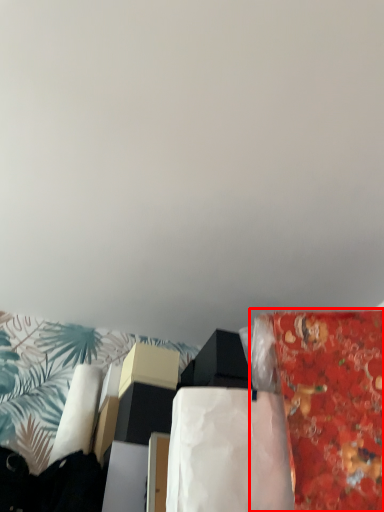
Question: From the image's perspective, what is the correct spatial positioning of material (annotated by the red box) in reference to blanket?

Choices:
 (A) above
 (B) below

Answer: (A)